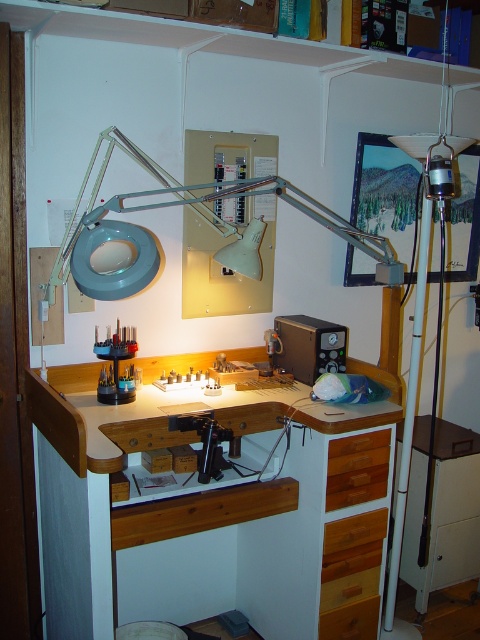
Question: Observing the image, what is the correct spatial positioning of wooden at center in reference to matte plastic tool holder at center?

Choices:
 (A) left
 (B) right

Answer: (B)

Question: Can you confirm if wooden at center is positioned to the left of matte plastic tool holder at center?

Choices:
 (A) yes
 (B) no

Answer: (B)

Question: Can you confirm if wooden at center is positioned above matte plastic tool holder at center?

Choices:
 (A) no
 (B) yes

Answer: (A)

Question: Which of the following is the closest to the observer?

Choices:
 (A) matte plastic tool holder at center
 (B) wooden at center
 (C) wooden drawer at lower right

Answer: (B)

Question: Which object is the closest to the wooden at center?

Choices:
 (A) wooden drawer at lower right
 (B) matte plastic tool holder at center

Answer: (A)

Question: Among these points, which one is farthest from the camera?

Choices:
 (A) (361, 540)
 (B) (308, 515)
 (C) (119, 349)

Answer: (A)